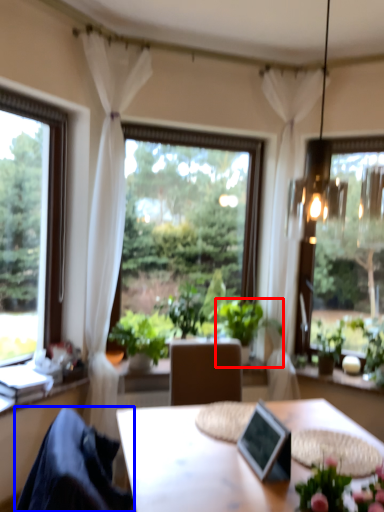
Question: Which object appears closest to the camera in this image, houseplant (highlighted by a red box) or chair (highlighted by a blue box)?

Choices:
 (A) houseplant
 (B) chair

Answer: (B)